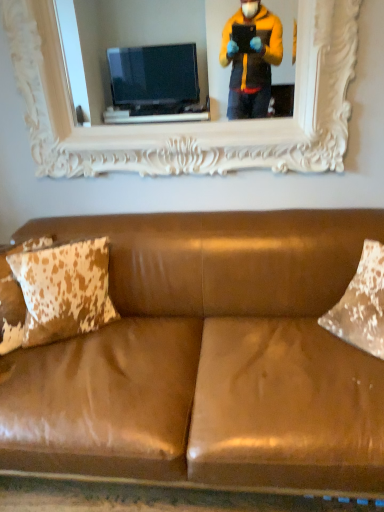
What is the approximate height of brown cowhide pillow at left?

It is 37.07 centimeters.

Describe the element at coordinates (60, 291) in the screenshot. I see `brown cowhide pillow at left` at that location.

The image size is (384, 512). What are the coordinates of `white carved wood picture frame at upper center` in the screenshot? It's located at (189, 124).

From the image's perspective, between brown cowhide pillow at left and brown leather couch at center, which one is located above?

brown cowhide pillow at left.

In the image, is brown cowhide pillow at left positioned in front of or behind brown leather couch at center?

In the image, brown cowhide pillow at left appears behind brown leather couch at center.

From a real-world perspective, is brown cowhide pillow at left above or below brown leather couch at center?

Clearly, from a real-world perspective, brown cowhide pillow at left is above brown leather couch at center.

Is white carved wood picture frame at upper center wider than brown cowhide pillow at left?

No, white carved wood picture frame at upper center is not wider than brown cowhide pillow at left.

Where is `picture frame that is on the right side of brown cowhide pillow at left`? picture frame that is on the right side of brown cowhide pillow at left is located at coordinates (189, 124).

In the image, is white carved wood picture frame at upper center positioned in front of or behind brown cowhide pillow at left?

Clearly, white carved wood picture frame at upper center is behind brown cowhide pillow at left.

Which is more to the right, brown cowhide pillow at left or white carved wood picture frame at upper center?

white carved wood picture frame at upper center is more to the right.

Considering the relative sizes of brown cowhide pillow at left and white carved wood picture frame at upper center in the image provided, is brown cowhide pillow at left bigger than white carved wood picture frame at upper center?

Actually, brown cowhide pillow at left might be smaller than white carved wood picture frame at upper center.

Which is behind, point (42, 238) or point (176, 168)?

The point (176, 168) is farther from the camera.

From the image's perspective, does brown cowhide pillow at left appear lower than white carved wood picture frame at upper center?

Correct, brown cowhide pillow at left appears lower than white carved wood picture frame at upper center in the image.

Is brown leather couch at center positioned before brown cowhide pillow at left?

Yes, brown leather couch at center is closer to the viewer.

Would you consider brown leather couch at center to be distant from brown cowhide pillow at left?

No.

Does point (241, 324) appear closer or farther from the camera than point (66, 312)?

Clearly, point (241, 324) is more distant from the camera than point (66, 312).

Does brown leather couch at center contain brown cowhide pillow at left?

Yes, brown cowhide pillow at left is inside brown leather couch at center.

From the image's perspective, is white carved wood picture frame at upper center positioned above or below brown leather couch at center?

white carved wood picture frame at upper center is situated higher than brown leather couch at center in the image.

Choose the correct answer: Is white carved wood picture frame at upper center inside brown leather couch at center or outside it?

white carved wood picture frame at upper center cannot be found inside brown leather couch at center.

Is white carved wood picture frame at upper center oriented towards brown leather couch at center?

No, white carved wood picture frame at upper center does not turn towards brown leather couch at center.

Which is farther, (344,126) or (232,256)?

Point (344,126)

From the image's perspective, which one is positioned higher, brown leather couch at center or white carved wood picture frame at upper center?

white carved wood picture frame at upper center appears higher in the image.

Does brown leather couch at center have a greater height compared to white carved wood picture frame at upper center?

Incorrect, the height of brown leather couch at center is not larger of that of white carved wood picture frame at upper center.

Is brown leather couch at center located outside white carved wood picture frame at upper center?

Absolutely, brown leather couch at center is external to white carved wood picture frame at upper center.

Consider the image. Could you tell me if brown leather couch at center is turned towards white carved wood picture frame at upper center?

No.

Locate an element on the screen. The image size is (384, 512). studio couch below the brown cowhide pillow at left (from a real-world perspective) is located at coordinates (207, 360).

The width and height of the screenshot is (384, 512). Identify the location of pillow located on the left of white carved wood picture frame at upper center. pyautogui.click(x=60, y=291).

Looking at the image, which one is located closer to brown leather couch at center, brown cowhide pillow at left or white carved wood picture frame at upper center?

The object closer to brown leather couch at center is brown cowhide pillow at left.

Which object lies nearer to the anchor point white carved wood picture frame at upper center, brown cowhide pillow at left or brown leather couch at center?

The object closer to white carved wood picture frame at upper center is brown cowhide pillow at left.

Based on their spatial positions, is white carved wood picture frame at upper center or brown leather couch at center closer to brown cowhide pillow at left?

Based on the image, brown leather couch at center appears to be nearer to brown cowhide pillow at left.

Looking at the image, which one is located further to white carved wood picture frame at upper center, brown leather couch at center or brown cowhide pillow at left?

brown leather couch at center.

Considering their positions, is white carved wood picture frame at upper center positioned closer to brown leather couch at center than brown cowhide pillow at left?

Based on the image, brown cowhide pillow at left appears to be nearer to brown leather couch at center.

Which object lies further to the anchor point brown cowhide pillow at left, brown leather couch at center or white carved wood picture frame at upper center?

white carved wood picture frame at upper center is further to brown cowhide pillow at left.

This screenshot has height=512, width=384. I want to click on pillow between white carved wood picture frame at upper center and brown leather couch at center from top to bottom, so click(x=60, y=291).